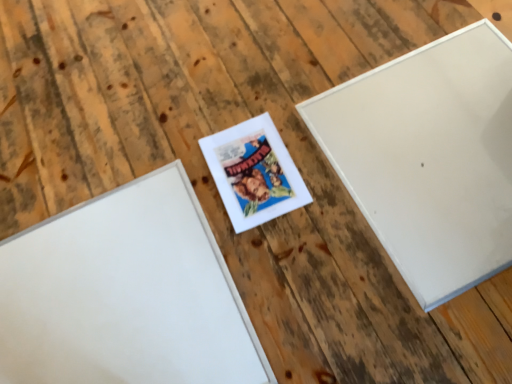
The image size is (512, 384). Identify the location of vacant space underneath white matte picture frame at upper right, the first picture frame positioned from the right (from a real-world perspective). (434, 142).